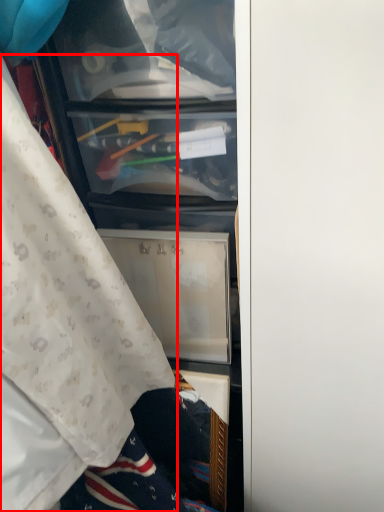
Question: From the image's perspective, where is curtain (annotated by the red box) located in relation to door in the image?

Choices:
 (A) above
 (B) below

Answer: (A)